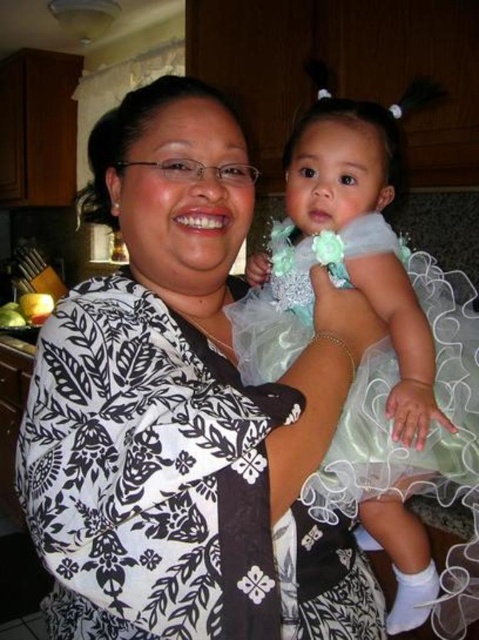
Question: Which point is farther to the camera?

Choices:
 (A) white printed dress at center
 (B) tulle dress at center

Answer: (B)

Question: Which point is closer to the camera?

Choices:
 (A) tulle dress at center
 (B) white printed dress at center

Answer: (B)

Question: Is white printed dress at center in front of tulle dress at center?

Choices:
 (A) no
 (B) yes

Answer: (B)

Question: Which point is farther to the camera?

Choices:
 (A) tulle dress at center
 (B) white printed dress at center

Answer: (A)

Question: In this image, where is white printed dress at center located relative to tulle dress at center?

Choices:
 (A) below
 (B) above

Answer: (B)

Question: Is white printed dress at center positioned before tulle dress at center?

Choices:
 (A) yes
 (B) no

Answer: (A)